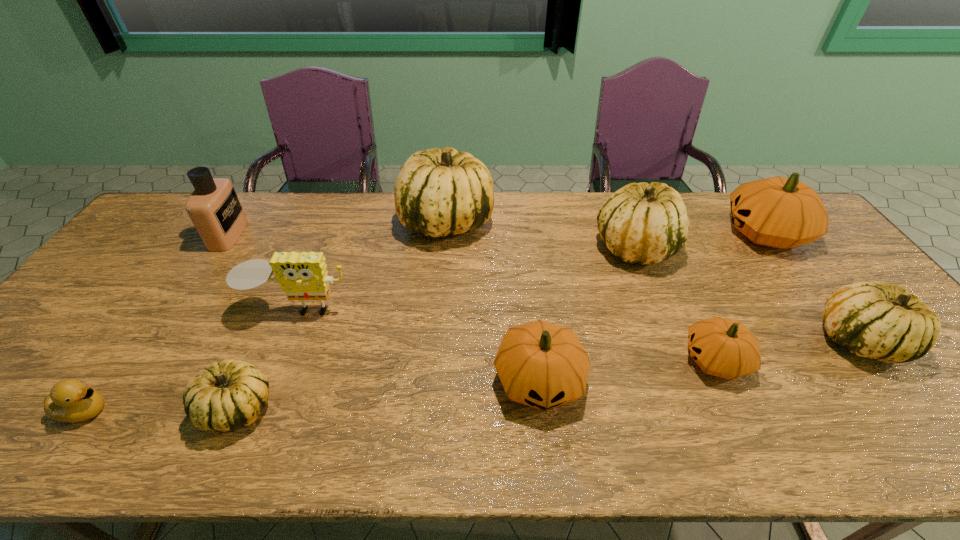
Identify the location of free space that is in between the leftmost gourd and the second biggest orange gourd. This screenshot has width=960, height=540. (389, 394).

You are a GUI agent. You are given a task and a screenshot of the screen. Output one action in this format:
    pyautogui.click(x=<x>, y=<y>)
    Task: Click on the free spot between the perfume and the second nearest white gourd
    The image size is (960, 540).
    Given the screenshot: What is the action you would take?
    pyautogui.click(x=543, y=288)

Find the location of a particular element. This screenshot has height=540, width=960. vacant region between the second orange gourd from right to left and the perfume is located at coordinates (472, 298).

Identify the location of object identified as the fourth closest to the sponge. This screenshot has height=540, width=960. (71, 401).

Locate an element on the screen. object that is the fifth closest to the second white gourd from left to right is located at coordinates (214, 208).

I want to click on the fourth closest gourd relative to the biggest white gourd, so click(x=721, y=347).

Identify which gourd is the fifth closest to the duckling. Please provide its 2D coordinates. Your answer should be formatted as a tuple, i.e. [(x, y)], where the tuple contains the x and y coordinates of a point satisfying the conditions above.

[(721, 347)]

Select which white gourd appears as the third closest to the duckling. Please provide its 2D coordinates. Your answer should be formatted as a tuple, i.e. [(x, y)], where the tuple contains the x and y coordinates of a point satisfying the conditions above.

[(643, 223)]

Identify which white gourd is located as the nearest to the beige perfume. Please provide its 2D coordinates. Your answer should be formatted as a tuple, i.e. [(x, y)], where the tuple contains the x and y coordinates of a point satisfying the conditions above.

[(224, 396)]

The width and height of the screenshot is (960, 540). Identify the location of orange gourd object that ranks as the third closest to the beige perfume. (778, 212).